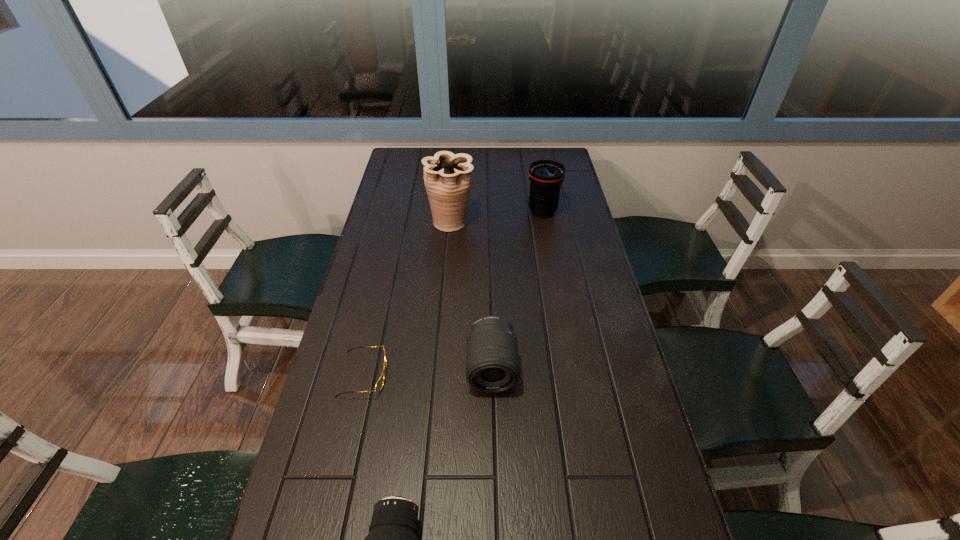
Locate an element on the screen. Image resolution: width=960 pixels, height=540 pixels. free space located 0.230m on the front-facing side of the leftmost object is located at coordinates (480, 375).

This screenshot has width=960, height=540. Find the location of `object positioned at the left edge`. object positioned at the left edge is located at coordinates (380, 382).

Where is `object situated at the right edge`? object situated at the right edge is located at coordinates (546, 176).

Where is `vacant area at the far edge`? vacant area at the far edge is located at coordinates tap(523, 150).

At what (x,y) coordinates should I click in order to perform the action: click on vacant space at the left edge of the desktop. Please return your answer as a coordinate pair (x, y). Image resolution: width=960 pixels, height=540 pixels. Looking at the image, I should click on (374, 269).

The height and width of the screenshot is (540, 960). In the image, there is a desktop. In order to click on free space at the right edge in this screenshot , I will do `click(569, 296)`.

The height and width of the screenshot is (540, 960). What are the coordinates of `free space between the third shortest object and the shortest object` in the screenshot? It's located at (428, 372).

Locate an element on the screen. This screenshot has width=960, height=540. free area in between the second telephoto lens from left to right and the spectacles is located at coordinates (428, 372).

The width and height of the screenshot is (960, 540). I want to click on free space between the tallest object and the second tallest object, so click(496, 217).

This screenshot has width=960, height=540. I want to click on free space between the second nearest telephoto lens and the rightmost telephoto lens, so click(517, 289).